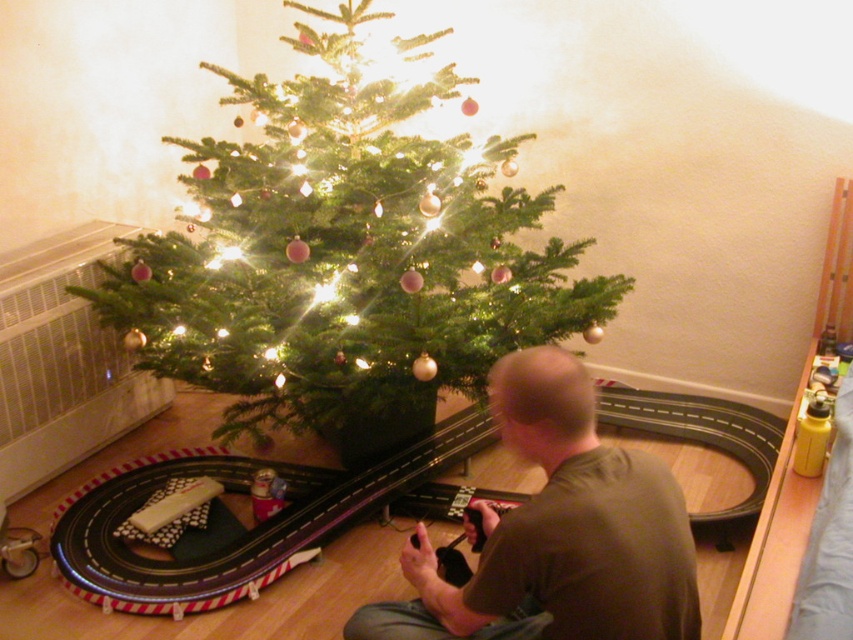
Question: Is green matte christmas tree at center bigger than brown cotton shirt at center?

Choices:
 (A) yes
 (B) no

Answer: (A)

Question: Is green matte christmas tree at center to the right of brown cotton shirt at center from the viewer's perspective?

Choices:
 (A) no
 (B) yes

Answer: (A)

Question: Can you confirm if green matte christmas tree at center is wider than brown cotton shirt at center?

Choices:
 (A) yes
 (B) no

Answer: (A)